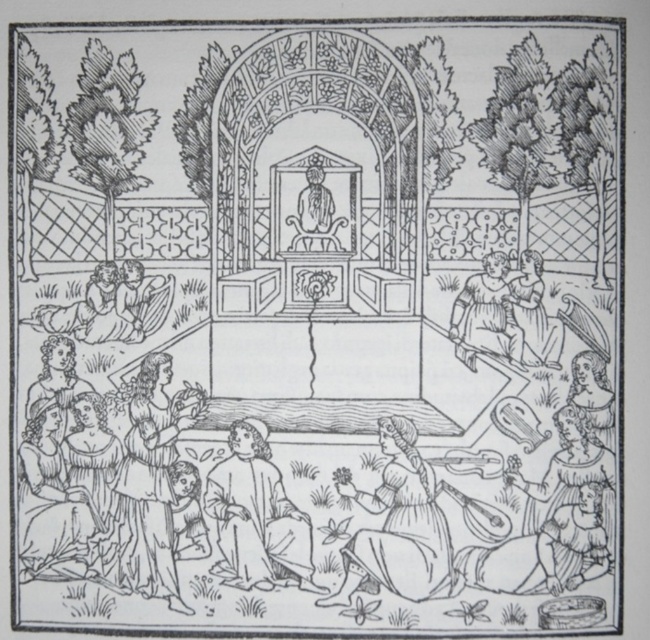
You are an artist observing the serene outdoor scene. You notice the smooth beige robe at lower center and the smooth brown dress at center. Which clothing item appears wider in the illustration?

The smooth beige robe at lower center appears wider than the smooth brown dress at center because its width surpasses the dress.

You are an artist sketching the serene outdoor scene. You need to place a small bird in the image such that it is positioned to the right of the smooth beige robe at lower center. Where should you place the bird?

The smooth beige robe at lower center is located at point (x=255, y=516). To place the bird to the right of it, position the bird at a coordinate with an x value greater than 0.808, such as (x=255, y=544).

You are an artist preparing to sketch the scene. You notice the smooth beige robe at lower center and the smooth skin figure at lower left. Which object is wider in the image?

The smooth beige robe at lower center is wider than the smooth skin figure at lower left.